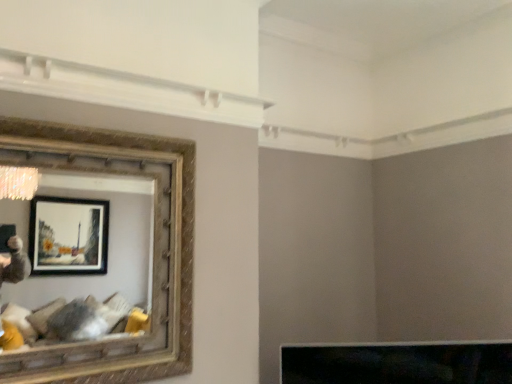
Question: Can you confirm if black glossy tv at lower center is taller than gold textured picture frame at left?

Choices:
 (A) yes
 (B) no

Answer: (B)

Question: Is gold textured picture frame at left at the back of black glossy tv at lower center?

Choices:
 (A) yes
 (B) no

Answer: (B)

Question: Can we say black glossy tv at lower center lies outside gold textured picture frame at left?

Choices:
 (A) no
 (B) yes

Answer: (B)

Question: From a real-world perspective, is black glossy tv at lower center below gold textured picture frame at left?

Choices:
 (A) yes
 (B) no

Answer: (A)

Question: Does black glossy tv at lower center have a greater width compared to gold textured picture frame at left?

Choices:
 (A) no
 (B) yes

Answer: (B)

Question: Is black glossy tv at lower center beside gold textured picture frame at left?

Choices:
 (A) yes
 (B) no

Answer: (B)

Question: Can you confirm if gold textured picture frame at left is smaller than black glossy tv at lower center?

Choices:
 (A) no
 (B) yes

Answer: (A)

Question: Considering the relative sizes of gold textured picture frame at left and black glossy tv at lower center in the image provided, is gold textured picture frame at left wider than black glossy tv at lower center?

Choices:
 (A) no
 (B) yes

Answer: (A)

Question: Is gold textured picture frame at left in front of black glossy tv at lower center?

Choices:
 (A) no
 (B) yes

Answer: (B)

Question: Does gold textured picture frame at left appear on the right side of black glossy tv at lower center?

Choices:
 (A) yes
 (B) no

Answer: (B)

Question: Are gold textured picture frame at left and black glossy tv at lower center located far from each other?

Choices:
 (A) no
 (B) yes

Answer: (A)

Question: Considering the relative sizes of gold textured picture frame at left and black glossy tv at lower center in the image provided, is gold textured picture frame at left thinner than black glossy tv at lower center?

Choices:
 (A) no
 (B) yes

Answer: (B)

Question: Would you say black glossy tv at lower center is to the left or to the right of gold textured picture frame at left in the picture?

Choices:
 (A) left
 (B) right

Answer: (B)